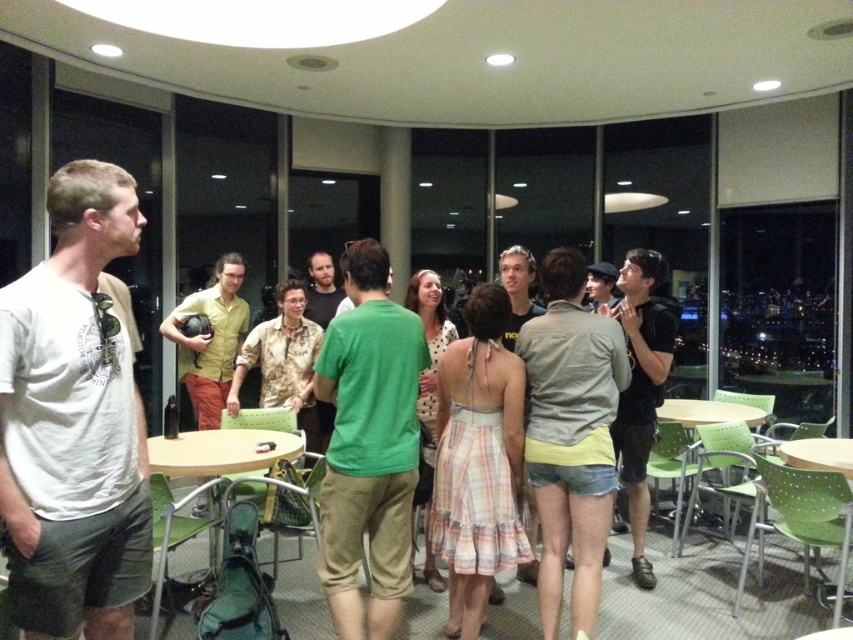
Question: Which is farther from the white cotton t-shirt at left?

Choices:
 (A) wooden table at center
 (B) green matte shirt at center

Answer: (A)

Question: Does white cotton t-shirt at left appear on the right side of denim shorts at center?

Choices:
 (A) no
 (B) yes

Answer: (A)

Question: Which object is positioned farthest from the white cotton t-shirt at left?

Choices:
 (A) black matte shirt at right
 (B) green matte shirt at center
 (C) matte green shirt at center

Answer: (C)

Question: Is black matte shirt at right to the right of wooden table at center from the viewer's perspective?

Choices:
 (A) no
 (B) yes

Answer: (B)

Question: Which point is closer to the camera?

Choices:
 (A) (705, 401)
 (B) (229, 381)
 (C) (231, 436)

Answer: (C)

Question: Is denim shorts at center positioned before black matte shirt at right?

Choices:
 (A) yes
 (B) no

Answer: (A)